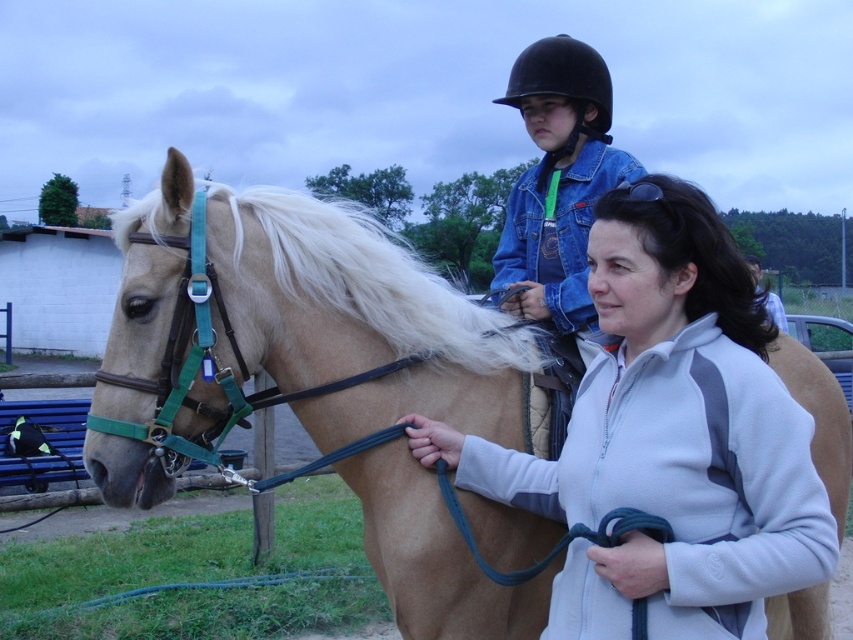
Is tan leather horse at center smaller than black matte helmet at upper center?

Incorrect, tan leather horse at center is not smaller in size than black matte helmet at upper center.

Which is behind, point (288, 321) or point (584, 84)?

Positioned behind is point (584, 84).

Identify the location of tan leather horse at center. The height and width of the screenshot is (640, 853). (292, 332).